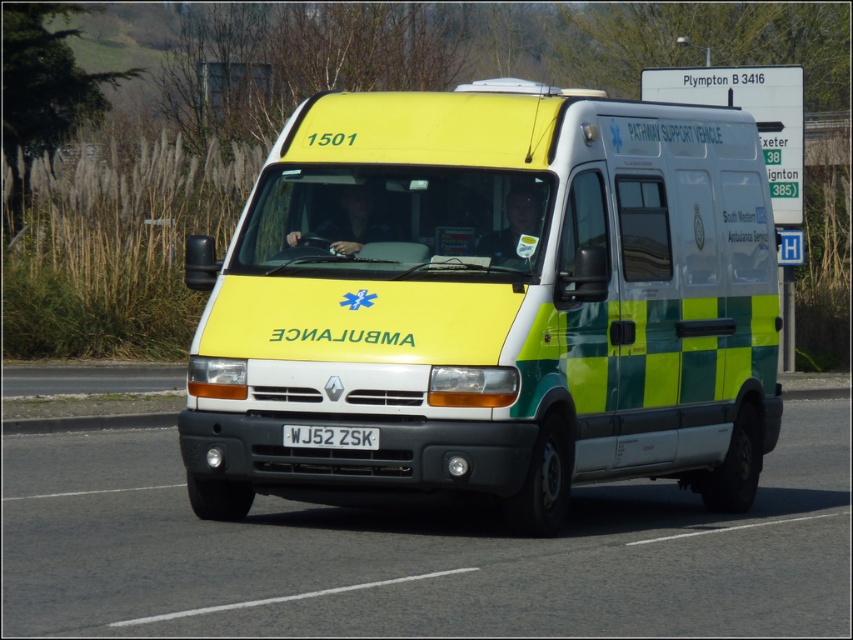
Question: Can you confirm if yellow/green checkered ambulance at center is thinner than white plastic license plate at center?

Choices:
 (A) yes
 (B) no

Answer: (B)

Question: Which object is the closest to the white plastic license plate at center?

Choices:
 (A) yellow/green checkered ambulance at center
 (B) yellow/green plastic van at center

Answer: (A)

Question: Among these points, which one is nearest to the camera?

Choices:
 (A) (369, 436)
 (B) (148, 445)
 (C) (459, 280)

Answer: (A)

Question: Observing the image, what is the correct spatial positioning of yellow/green checkered ambulance at center in reference to white plastic license plate at center?

Choices:
 (A) above
 (B) below

Answer: (A)

Question: Can you confirm if yellow/green checkered ambulance at center is wider than white plastic license plate at center?

Choices:
 (A) yes
 (B) no

Answer: (A)

Question: Estimate the real-world distances between objects in this image. Which object is closer to the yellow/green plastic van at center?

Choices:
 (A) yellow/green checkered ambulance at center
 (B) white plastic license plate at center

Answer: (A)